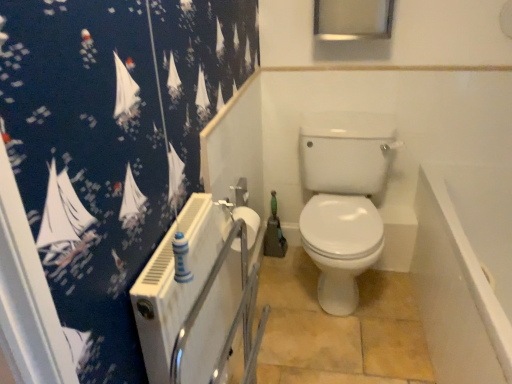
Question: Is white glossy toilet at center bigger than white matte toilet paper at center?

Choices:
 (A) yes
 (B) no

Answer: (A)

Question: Is white glossy toilet at center next to white matte toilet paper at center?

Choices:
 (A) no
 (B) yes

Answer: (A)

Question: Can we say white glossy toilet at center lies outside white matte toilet paper at center?

Choices:
 (A) yes
 (B) no

Answer: (A)

Question: Is white glossy toilet at center positioned far away from white matte toilet paper at center?

Choices:
 (A) yes
 (B) no

Answer: (B)

Question: Is the position of white glossy toilet at center less distant than that of white matte toilet paper at center?

Choices:
 (A) yes
 (B) no

Answer: (B)

Question: Is white glossy toilet at center turned away from white matte toilet paper at center?

Choices:
 (A) yes
 (B) no

Answer: (B)

Question: Considering the relative sizes of white matte toilet paper at center and white glossy bathtub at lower right in the image provided, is white matte toilet paper at center thinner than white glossy bathtub at lower right?

Choices:
 (A) no
 (B) yes

Answer: (B)

Question: Can you confirm if white matte toilet paper at center is wider than white glossy bathtub at lower right?

Choices:
 (A) no
 (B) yes

Answer: (A)

Question: Is white matte toilet paper at center shorter than white glossy bathtub at lower right?

Choices:
 (A) no
 (B) yes

Answer: (B)

Question: Does white matte toilet paper at center turn towards white glossy bathtub at lower right?

Choices:
 (A) no
 (B) yes

Answer: (B)

Question: Is white matte toilet paper at center outside white glossy bathtub at lower right?

Choices:
 (A) yes
 (B) no

Answer: (A)

Question: From the image's perspective, would you say white matte toilet paper at center is positioned over white glossy bathtub at lower right?

Choices:
 (A) no
 (B) yes

Answer: (B)

Question: Does white glossy bathtub at lower right have a greater width compared to white matte toilet paper at center?

Choices:
 (A) yes
 (B) no

Answer: (A)